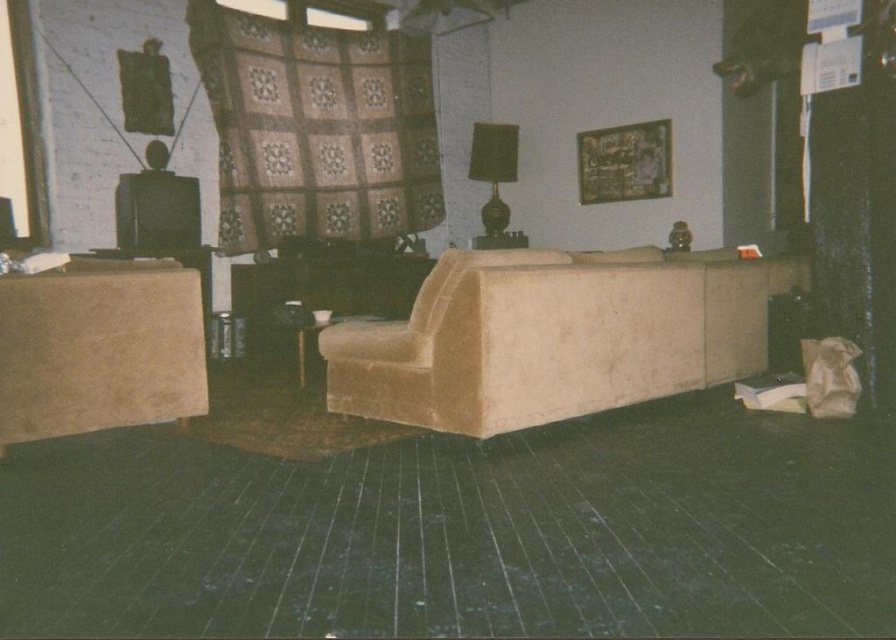
You are moving a large piece of furniture into the living room and need to navigate around the beige velvety couch at center and the suede beige ottoman at left. Which object should you move around first to reach the back wall?

You should move around the suede beige ottoman at left first because the beige velvety couch at center is further away from you, meaning the ottoman is closer and in your path first.